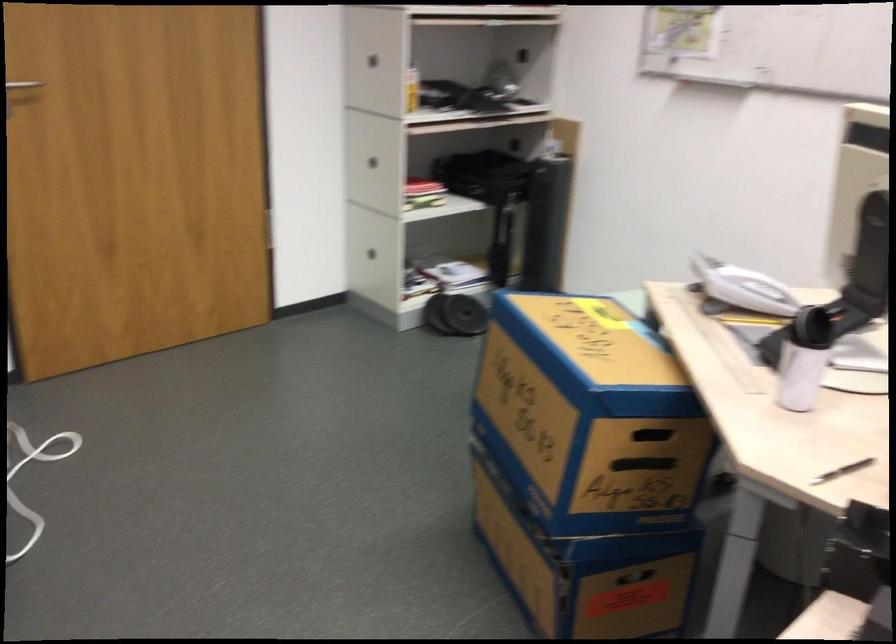
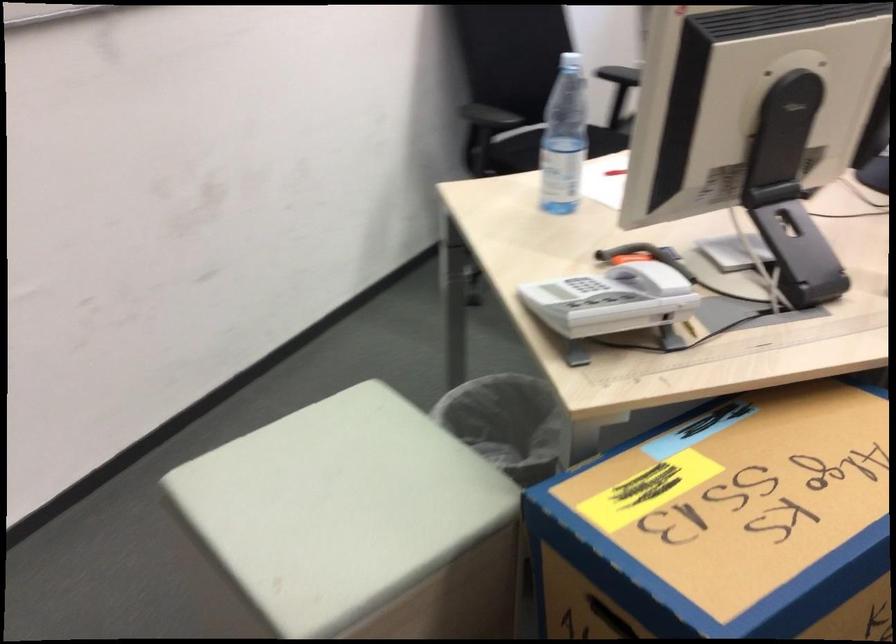
In the second image, find the point that corresponds to [757,275] in the first image.

(648, 268)